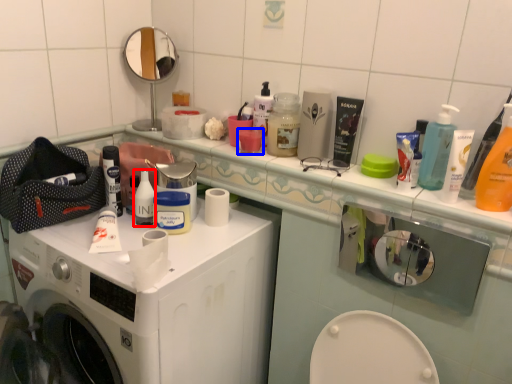
Question: Which object appears closest to the camera in this image, mouthwash (highlighted by a red box) or mouthwash (highlighted by a blue box)?

Choices:
 (A) mouthwash
 (B) mouthwash

Answer: (A)